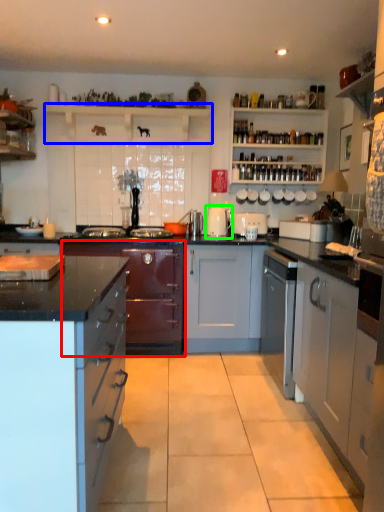
Question: Considering the real-world distances, which object is closest to cabinetry (highlighted by a red box)? shelf (highlighted by a blue box) or appliance (highlighted by a green box).

Choices:
 (A) shelf
 (B) appliance

Answer: (B)